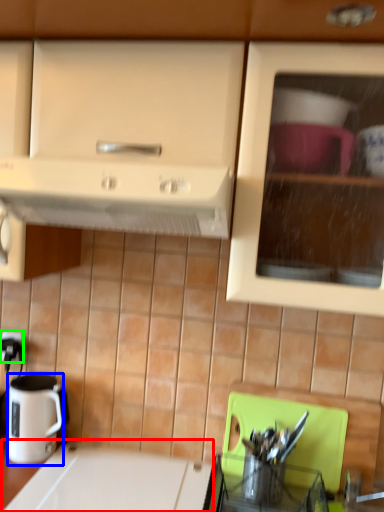
Question: Based on their relative distances, which object is farther from counter top (highlighted by a red box)? Choose from coffee cup (highlighted by a blue box) and electric outlet (highlighted by a green box).

Choices:
 (A) coffee cup
 (B) electric outlet

Answer: (B)